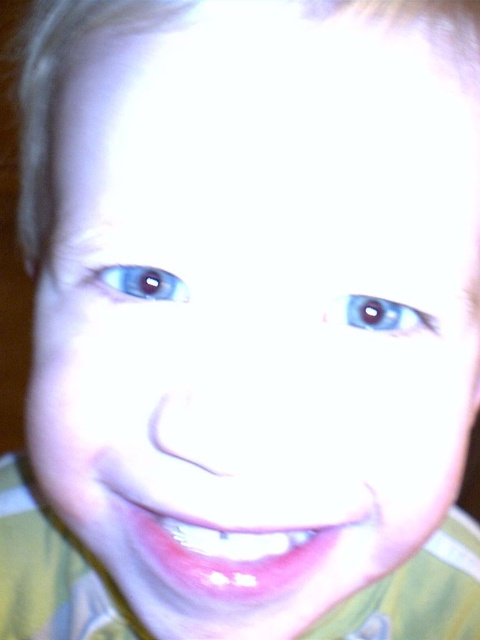
Is pink glossy teeth at center thinner than blue glossy eye at upper left?

In fact, pink glossy teeth at center might be wider than blue glossy eye at upper left.

Is point (300, 552) farther from viewer compared to point (168, 288)?

Yes, it is.

Identify the location of pink glossy teeth at center. Image resolution: width=480 pixels, height=640 pixels. (232, 550).

The height and width of the screenshot is (640, 480). Find the location of `pink glossy teeth at center`. pink glossy teeth at center is located at coordinates (232, 550).

Which of these two, blue glossy eye at center or blue glossy eye at upper left, stands shorter?

With less height is blue glossy eye at center.

Between point (371, 314) and point (183, 291), which one is positioned behind?

The point (371, 314) is behind.

I want to click on blue glossy eye at center, so 379,316.

This screenshot has height=640, width=480. In order to click on blue glossy eye at center in this screenshot , I will do `click(379, 316)`.

Is point (210, 528) positioned after point (367, 298)?

Yes, it is.

Is pink glossy teeth at center shorter than blue glossy eye at center?

Incorrect, pink glossy teeth at center's height does not fall short of blue glossy eye at center's.

The width and height of the screenshot is (480, 640). Identify the location of pink glossy teeth at center. (232, 550).

Image resolution: width=480 pixels, height=640 pixels. What are the coordinates of `pink glossy teeth at center` in the screenshot? It's located at (232, 550).